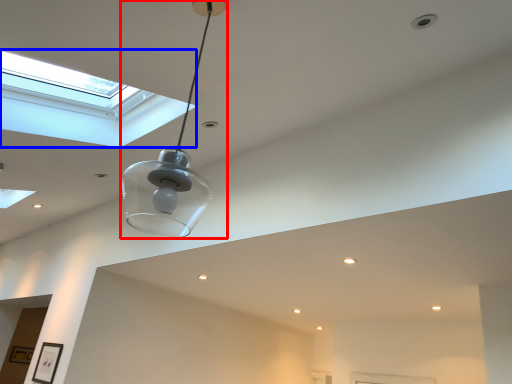
Question: Which point is further to the camera, lamp (highlighted by a red box) or window (highlighted by a blue box)?

Choices:
 (A) lamp
 (B) window

Answer: (B)